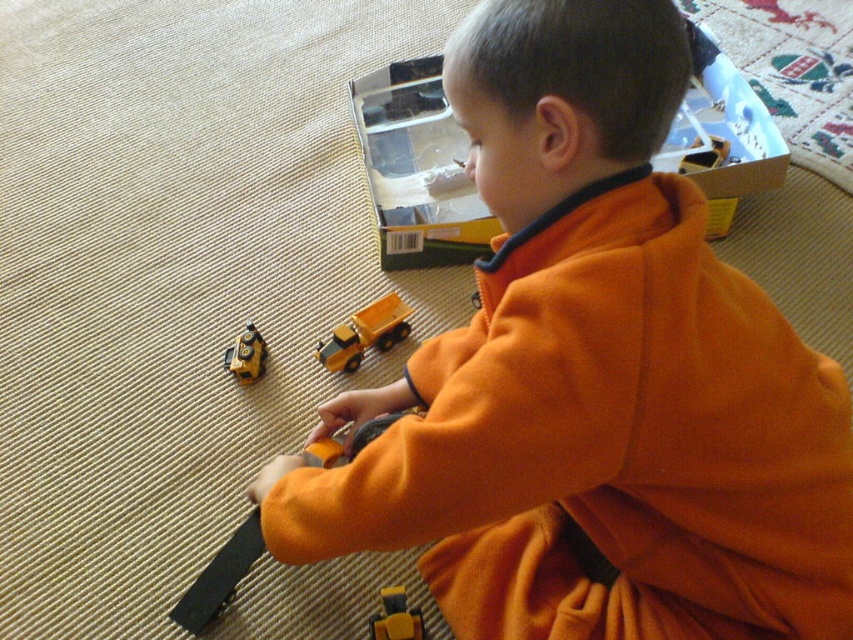
You are helping a child organize their toys. You see the yellow matte dump truck at center and the yellow matte toy truck at lower center. Which toy is wider?

The yellow matte dump truck at center is wider than the yellow matte toy truck at lower center.

The child is wearing an orange fleece jacket at center and holding a metallic yellow truck at lower left. Which object is taller?

The orange fleece jacket at center is taller than the metallic yellow truck at lower left.

What is located at the coordinates point (364, 333)?

The yellow matte dump truck at center is located at point (364, 333).